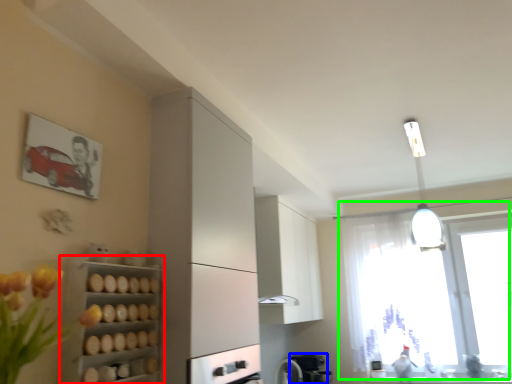
Question: Based on their relative distances, which object is farther from shelf (highlighted by a red box)? Choose from coffee machine (highlighted by a blue box) and window (highlighted by a green box).

Choices:
 (A) coffee machine
 (B) window

Answer: (B)